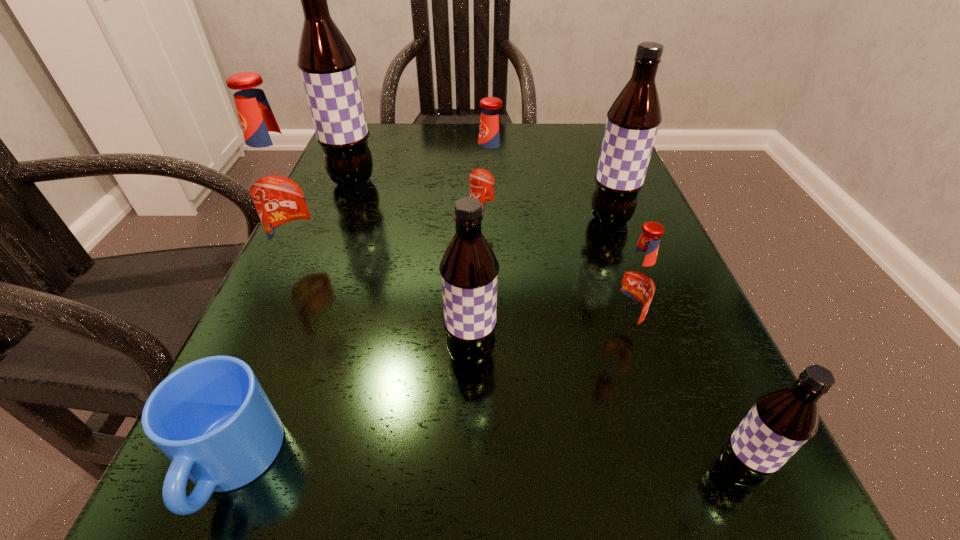
This screenshot has width=960, height=540. Find the location of `the farthest brown root beer`. the farthest brown root beer is located at coordinates (327, 65).

You are a GUI agent. You are given a task and a screenshot of the screen. Output one action in this format:
    pyautogui.click(x=<x>, y=<y>)
    Task: Click on the farthest root beer
    This screenshot has width=960, height=540.
    Given the screenshot: What is the action you would take?
    pyautogui.click(x=327, y=65)

This screenshot has height=540, width=960. Identify the location of the second biggest brown root beer. (633, 119).

Where is `the biggest red root beer`? Image resolution: width=960 pixels, height=540 pixels. the biggest red root beer is located at coordinates (280, 188).

You are a GUI agent. You are given a task and a screenshot of the screen. Output one action in this format:
    pyautogui.click(x=<x>, y=<y>)
    Task: Click on the fourth farthest object
    The image size is (960, 540).
    Given the screenshot: What is the action you would take?
    pyautogui.click(x=280, y=188)

Image resolution: width=960 pixels, height=540 pixels. What are the coordinates of `the farthest red root beer` in the screenshot? It's located at (490, 173).

Where is `the second red root beer from left to right`? This screenshot has height=540, width=960. the second red root beer from left to right is located at coordinates (490, 173).

This screenshot has height=540, width=960. What are the coordinates of `the second nearest brown root beer` in the screenshot? It's located at (469, 269).

This screenshot has height=540, width=960. I want to click on the third brown root beer from right to left, so click(469, 269).

This screenshot has width=960, height=540. Find the location of `the nearest red root beer`. the nearest red root beer is located at coordinates (635, 285).